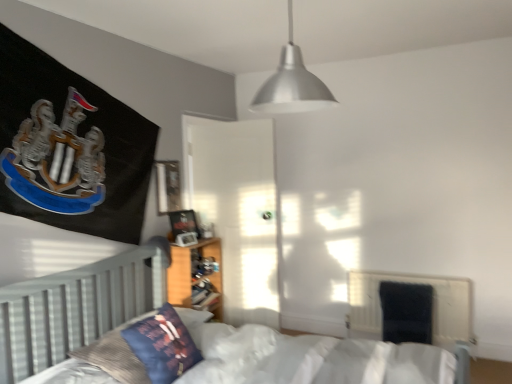
Question: From a real-world perspective, is metallic silver pendant light at upper center under black fabric radiator at lower right?

Choices:
 (A) yes
 (B) no

Answer: (B)

Question: From the image's perspective, is metallic silver pendant light at upper center above black fabric radiator at lower right?

Choices:
 (A) yes
 (B) no

Answer: (A)

Question: Is metallic silver pendant light at upper center positioned beyond the bounds of black fabric radiator at lower right?

Choices:
 (A) no
 (B) yes

Answer: (B)

Question: From a real-world perspective, is metallic silver pendant light at upper center positioned over black fabric radiator at lower right based on gravity?

Choices:
 (A) yes
 (B) no

Answer: (A)

Question: Considering the relative sizes of metallic silver pendant light at upper center and black fabric radiator at lower right in the image provided, is metallic silver pendant light at upper center shorter than black fabric radiator at lower right?

Choices:
 (A) no
 (B) yes

Answer: (B)

Question: In terms of height, does velvet blue pillow at lower left look taller or shorter compared to black fabric radiator at lower right?

Choices:
 (A) short
 (B) tall

Answer: (A)

Question: In the image, is velvet blue pillow at lower left positioned in front of or behind black fabric radiator at lower right?

Choices:
 (A) behind
 (B) front

Answer: (B)

Question: Considering the positions of point (163, 352) and point (376, 311), is point (163, 352) closer or farther from the camera than point (376, 311)?

Choices:
 (A) closer
 (B) farther

Answer: (A)

Question: Based on their sizes in the image, would you say velvet blue pillow at lower left is bigger or smaller than black fabric radiator at lower right?

Choices:
 (A) big
 (B) small

Answer: (B)

Question: In the image, is velvet dark blue armchair at lower right positioned in front of or behind black fabric radiator at lower right?

Choices:
 (A) front
 (B) behind

Answer: (B)

Question: Does point (394, 316) appear closer or farther from the camera than point (450, 347)?

Choices:
 (A) farther
 (B) closer

Answer: (A)

Question: Is velvet dark blue armchair at lower right spatially inside black fabric radiator at lower right, or outside of it?

Choices:
 (A) outside
 (B) inside

Answer: (B)

Question: From a real-world perspective, relative to black fabric radiator at lower right, is velvet dark blue armchair at lower right vertically above or below?

Choices:
 (A) above
 (B) below

Answer: (A)

Question: Choose the correct answer: Is metallic silver pendant light at upper center inside velvet dark blue armchair at lower right or outside it?

Choices:
 (A) outside
 (B) inside

Answer: (A)

Question: From the image's perspective, is metallic silver pendant light at upper center positioned above or below velvet dark blue armchair at lower right?

Choices:
 (A) below
 (B) above

Answer: (B)